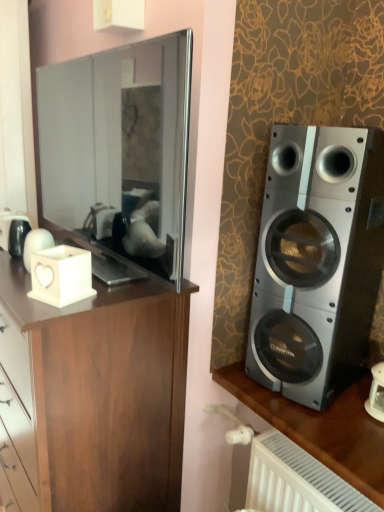
The height and width of the screenshot is (512, 384). Find the location of `vacant area located to the right-hand side of white matte candle holder at left`. vacant area located to the right-hand side of white matte candle holder at left is located at coordinates (110, 295).